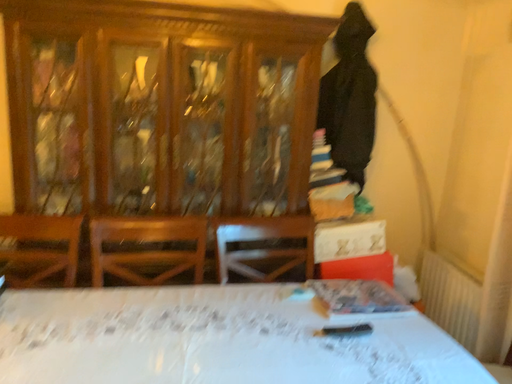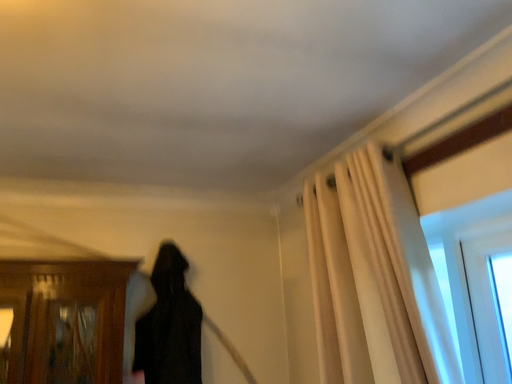
Question: How did the camera likely rotate when shooting the video?

Choices:
 (A) rotated downward
 (B) rotated upward

Answer: (B)